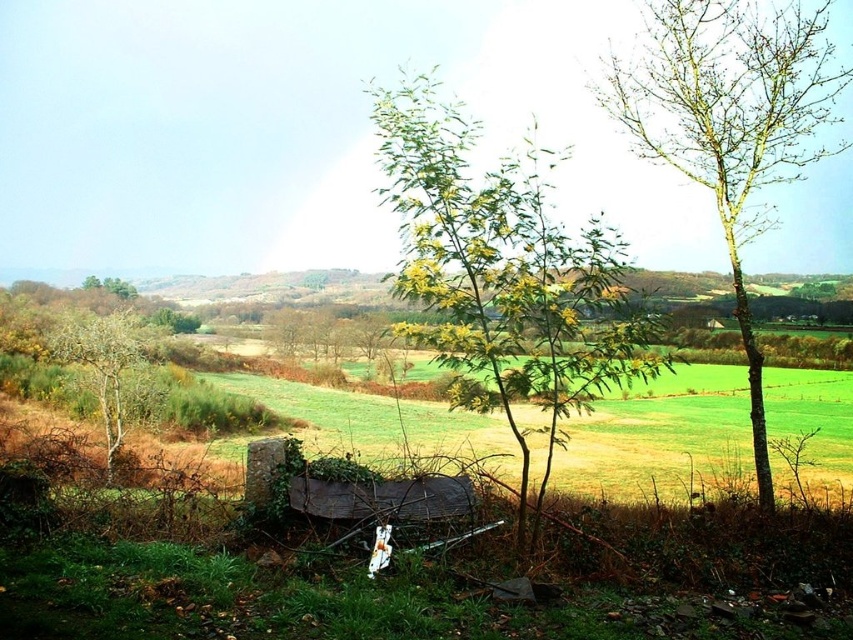
You are an environmental researcher studying tree growth in the area. You observe the green leafy tree at right and the smooth brown tree at left. Which tree would you recommend measuring first if you want to prioritize taller trees for a study on canopy development?

The green leafy tree at right is taller than the smooth brown tree at left, so you should measure the green leafy tree at right first for the study on canopy development.

You are a hiker trying to navigate through the fields. You see the green leafy tree at right and the smooth brown tree at left. Which tree would you choose as a landmark if you want to mark a larger, more noticeable point in the landscape?

The green leafy tree at right is bigger than the smooth brown tree at left, so it would be a better landmark for marking a larger, more noticeable point in the landscape.